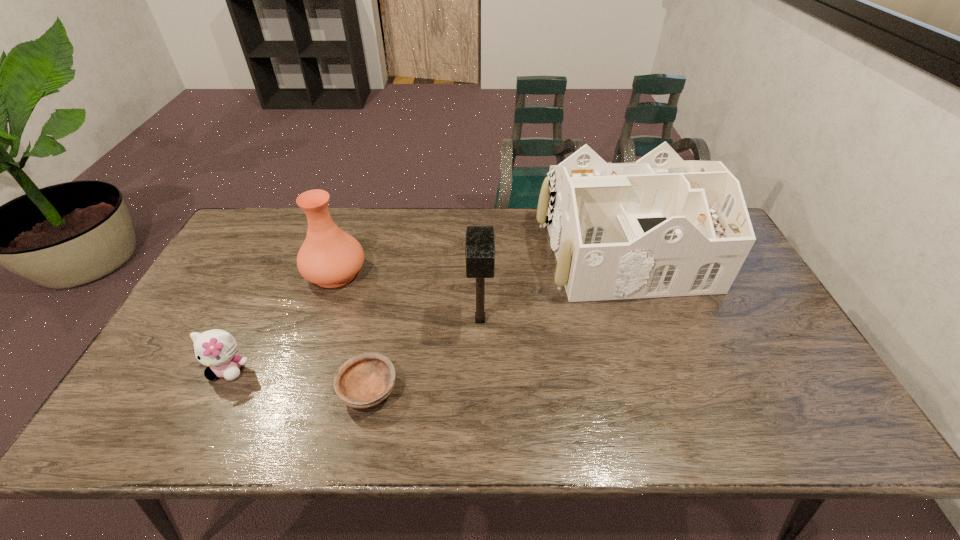
Choose which object is the nearest neighbor to the fourth object from left to right. Please provide its 2D coordinates. Your answer should be formatted as a tuple, i.e. [(x, y)], where the tuple contains the x and y coordinates of a point satisfying the conditions above.

[(660, 227)]

Point out which object is positioned as the nearest to the vase. Please provide its 2D coordinates. Your answer should be formatted as a tuple, i.e. [(x, y)], where the tuple contains the x and y coordinates of a point satisfying the conditions above.

[(217, 349)]

Identify the location of free spot that satisfies the following two spatial constraints: 1. on the back side of the rightmost object; 2. on the right side of the vase. tap(343, 252).

Locate an element on the screen. The image size is (960, 540). vacant point that satisfies the following two spatial constraints: 1. on the front side of the vase; 2. on the right side of the fourth object from left to right is located at coordinates (319, 320).

Locate an element on the screen. This screenshot has width=960, height=540. vacant region that satisfies the following two spatial constraints: 1. on the front-facing side of the kitten; 2. on the right side of the third object from right to left is located at coordinates (218, 390).